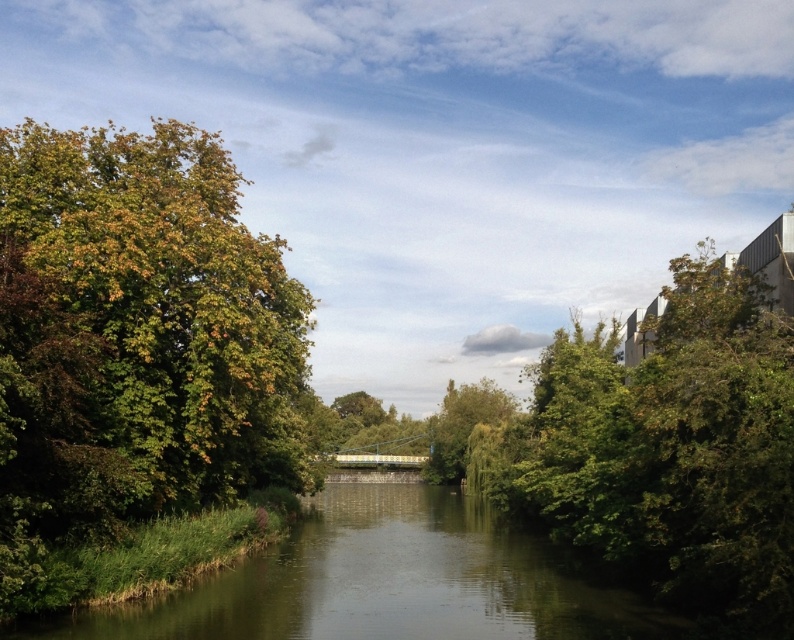
Question: Which of these objects is positioned closest to the green leafy tree at right?

Choices:
 (A) green smooth water at center
 (B) green leafy tree at center

Answer: (A)

Question: Does green leafy tree at right have a larger size compared to green leafy tree at center?

Choices:
 (A) no
 (B) yes

Answer: (B)

Question: Is green leafy tree at left thinner than green smooth water at center?

Choices:
 (A) yes
 (B) no

Answer: (B)

Question: Which point is closer to the camera?

Choices:
 (A) (220, 154)
 (B) (249, 588)
 (C) (438, 477)
 (D) (762, 304)

Answer: (D)

Question: Considering the real-world distances, which object is farthest from the green smooth water at center?

Choices:
 (A) green leafy tree at center
 (B) green leafy tree at left
 (C) green leafy tree at right

Answer: (A)

Question: Observing the image, what is the correct spatial positioning of green leafy tree at left in reference to green leafy tree at right?

Choices:
 (A) left
 (B) right

Answer: (A)